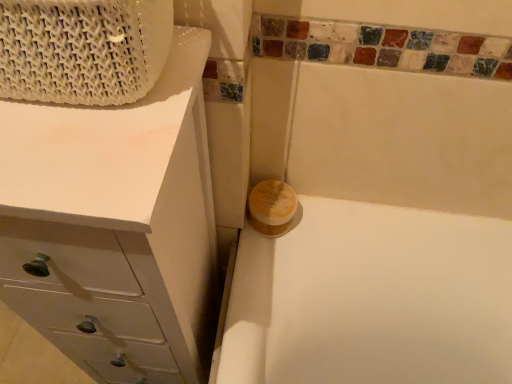
Question: From a real-world perspective, is white woven basket at upper left above or below white matte chest of drawers at upper left?

Choices:
 (A) above
 (B) below

Answer: (A)

Question: In terms of width, does white woven basket at upper left look wider or thinner when compared to white matte chest of drawers at upper left?

Choices:
 (A) thin
 (B) wide

Answer: (A)

Question: Which is farther from the yellow matte soap at center?

Choices:
 (A) white woven basket at upper left
 (B) white matte chest of drawers at upper left

Answer: (A)

Question: Which is farther from the white woven basket at upper left?

Choices:
 (A) white matte chest of drawers at upper left
 (B) yellow matte soap at center

Answer: (B)